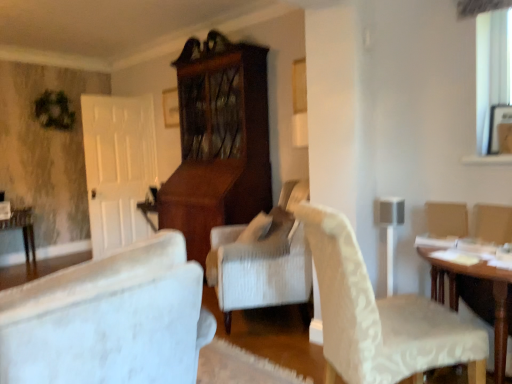
Question: Does wooden table at lower left, marked as the 2th table in a front-to-back arrangement, appear on the right side of wooden table at right, the 2th table positioned from the left?

Choices:
 (A) yes
 (B) no

Answer: (B)

Question: Is the depth of wooden table at lower left, arranged as the second table when viewed from the right, greater than that of wooden table at right, the 2th table positioned from the left?

Choices:
 (A) yes
 (B) no

Answer: (A)

Question: From the image's perspective, would you say wooden table at lower left, placed as the 1th table when sorted from back to front, is shown under wooden table at right, acting as the second table starting from the back?

Choices:
 (A) no
 (B) yes

Answer: (A)

Question: Can we say wooden table at lower left, arranged as the second table when viewed from the right, lies outside wooden table at right, acting as the second table starting from the back?

Choices:
 (A) no
 (B) yes

Answer: (B)

Question: Is wooden table at lower left, marked as the 2th table in a front-to-back arrangement, thinner than wooden table at right, the 2th table positioned from the left?

Choices:
 (A) yes
 (B) no

Answer: (A)

Question: Can you confirm if wooden table at lower left, arranged as the second table when viewed from the right, is smaller than wooden table at right, the 2th table positioned from the left?

Choices:
 (A) yes
 (B) no

Answer: (A)

Question: Considering the relative positions of wooden table at right, which is counted as the first table, starting from the right, and white textured chair at center-right in the image provided, is wooden table at right, which is counted as the first table, starting from the right, behind white textured chair at center-right?

Choices:
 (A) yes
 (B) no

Answer: (A)

Question: Is wooden table at right, the first table when ordered from front to back, located outside white textured chair at center-right?

Choices:
 (A) no
 (B) yes

Answer: (B)

Question: Considering the relative positions of wooden table at right, the 2th table positioned from the left, and white textured chair at center-right in the image provided, is wooden table at right, the 2th table positioned from the left, in front of white textured chair at center-right?

Choices:
 (A) no
 (B) yes

Answer: (A)

Question: From the image's perspective, would you say wooden table at right, the first table when ordered from front to back, is shown under white textured chair at center-right?

Choices:
 (A) yes
 (B) no

Answer: (A)

Question: Can you confirm if wooden table at right, which is counted as the first table, starting from the right, is positioned to the right of white textured chair at center-right?

Choices:
 (A) yes
 (B) no

Answer: (A)

Question: Does wooden table at right, acting as the second table starting from the back, have a lesser width compared to white textured chair at center-right?

Choices:
 (A) no
 (B) yes

Answer: (A)

Question: Considering the relative sizes of wooden table at lower left, arranged as the second table when viewed from the right, and white textured chair at center-right in the image provided, is wooden table at lower left, arranged as the second table when viewed from the right, taller than white textured chair at center-right?

Choices:
 (A) no
 (B) yes

Answer: (A)